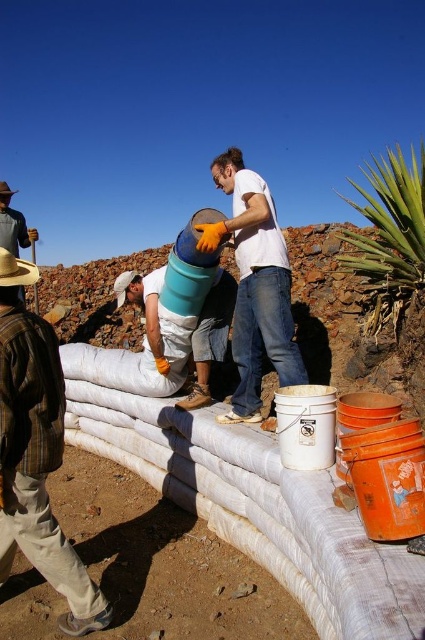
Is brown plaid shirt at left above white matte shirt at center?

Actually, brown plaid shirt at left is below white matte shirt at center.

Is brown plaid shirt at left thinner than white matte shirt at center?

Yes, brown plaid shirt at left is thinner than white matte shirt at center.

What do you see at coordinates (36, 452) in the screenshot?
I see `brown plaid shirt at left` at bounding box center [36, 452].

Find the location of a particular element. The width and height of the screenshot is (425, 640). brown plaid shirt at left is located at coordinates (36, 452).

Which of these two, white matte shirt at center or matte blue bucket at center, stands shorter?

matte blue bucket at center

Does point (238, 348) come in front of point (215, 324)?

Yes, it is in front of point (215, 324).

You are a GUI agent. You are given a task and a screenshot of the screen. Output one action in this format:
    pyautogui.click(x=<x>, y=<y>)
    Task: Click on the white matte shirt at center
    Image resolution: width=425 pixels, height=640 pixels.
    Given the screenshot: What is the action you would take?
    pyautogui.click(x=255, y=285)

Which is more to the right, brown plaid shirt at left or matte blue bucket at center?

From the viewer's perspective, matte blue bucket at center appears more on the right side.

Can you confirm if brown plaid shirt at left is thinner than matte blue bucket at center?

Yes.

Locate an element on the screen. This screenshot has width=425, height=640. brown plaid shirt at left is located at coordinates (36, 452).

Locate an element on the screen. brown plaid shirt at left is located at coordinates (36, 452).